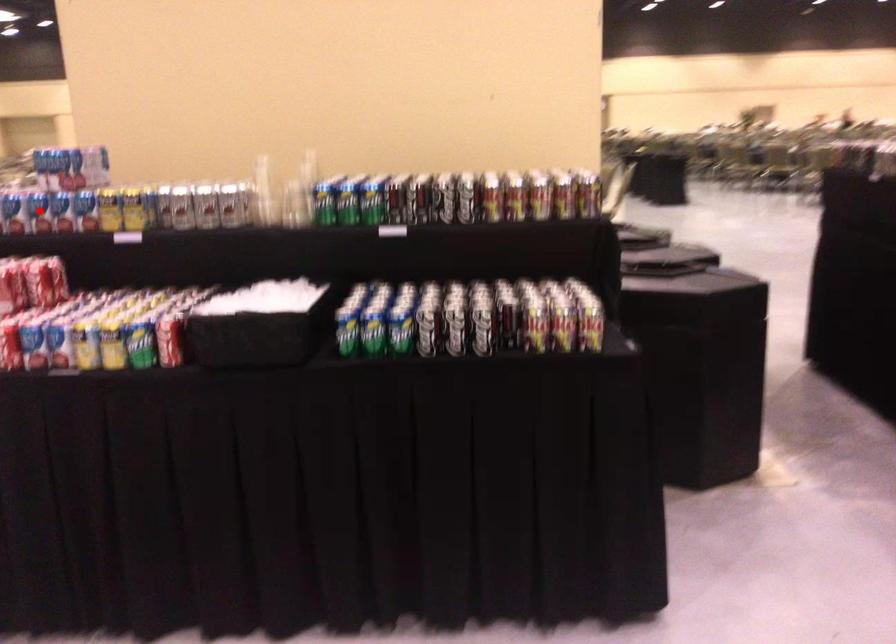
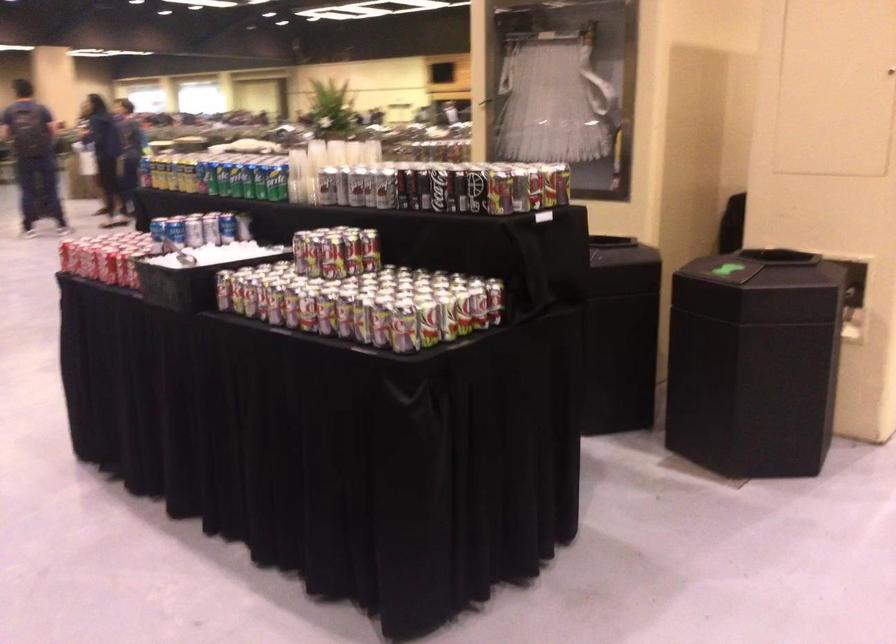
Question: I am providing you with two images of the same scene from different viewpoints. A red point is marked on the first image. At the location where the point appears in image 1, is it still visible in image 2?

Choices:
 (A) Yes
 (B) No

Answer: (B)